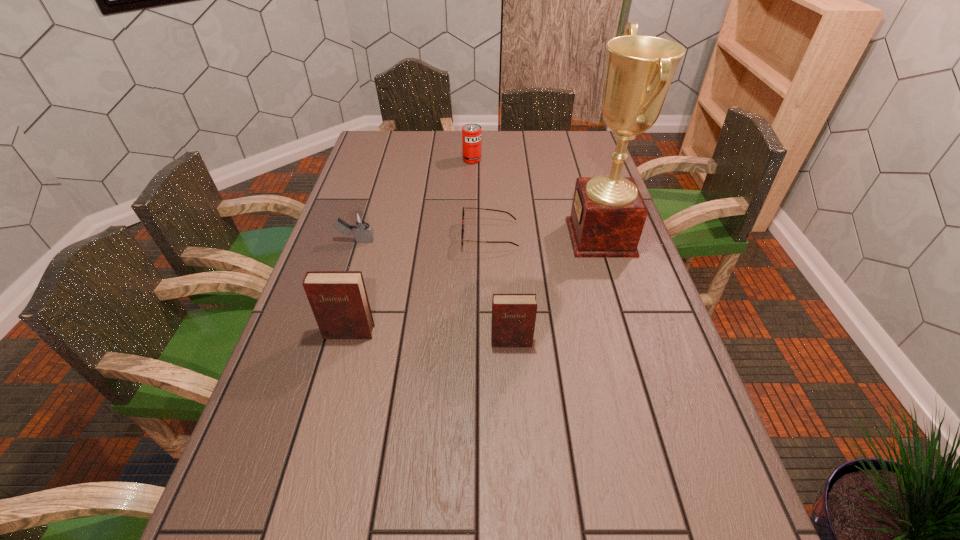
This screenshot has height=540, width=960. In order to click on vacant region located 0.150m on the right of the farthest object in this screenshot , I will do `click(520, 160)`.

The width and height of the screenshot is (960, 540). What are the coordinates of `free space located on the face of the shortest object` in the screenshot? It's located at (430, 236).

Where is `free region located 0.130m on the face of the shortest object`? Image resolution: width=960 pixels, height=540 pixels. free region located 0.130m on the face of the shortest object is located at coordinates (420, 236).

Locate an element on the screen. This screenshot has height=540, width=960. free point located 0.270m on the face of the shortest object is located at coordinates (374, 236).

The height and width of the screenshot is (540, 960). What are the coordinates of `free space located 0.200m on the front of the second shortest object` in the screenshot? It's located at (338, 296).

Where is `vacant space located 0.350m on the plaque of the trophy cup`? This screenshot has width=960, height=540. vacant space located 0.350m on the plaque of the trophy cup is located at coordinates (455, 237).

Find the location of a particular element. The height and width of the screenshot is (540, 960). free location located 0.060m on the plaque of the trophy cup is located at coordinates (550, 237).

You are a GUI agent. You are given a task and a screenshot of the screen. Output one action in this format:
    pyautogui.click(x=<x>, y=<y>)
    Task: Click on the free spot located on the plaque of the trophy cup
    This screenshot has height=540, width=960.
    Given the screenshot: What is the action you would take?
    pyautogui.click(x=501, y=237)

Where is `object located at the far edge`? object located at the far edge is located at coordinates (471, 133).

Locate an element on the screen. The height and width of the screenshot is (540, 960). diary at the left edge is located at coordinates (338, 299).